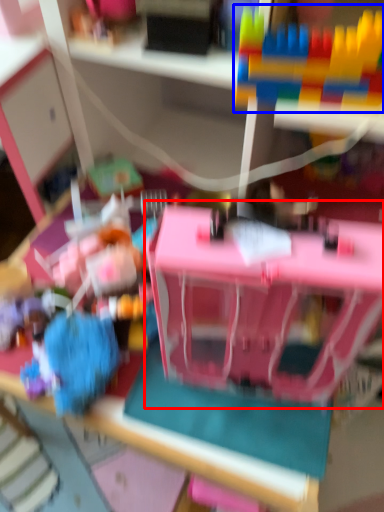
Question: Which object is closer to the camera taking this photo, toy (highlighted by a red box) or toy (highlighted by a blue box)?

Choices:
 (A) toy
 (B) toy

Answer: (A)